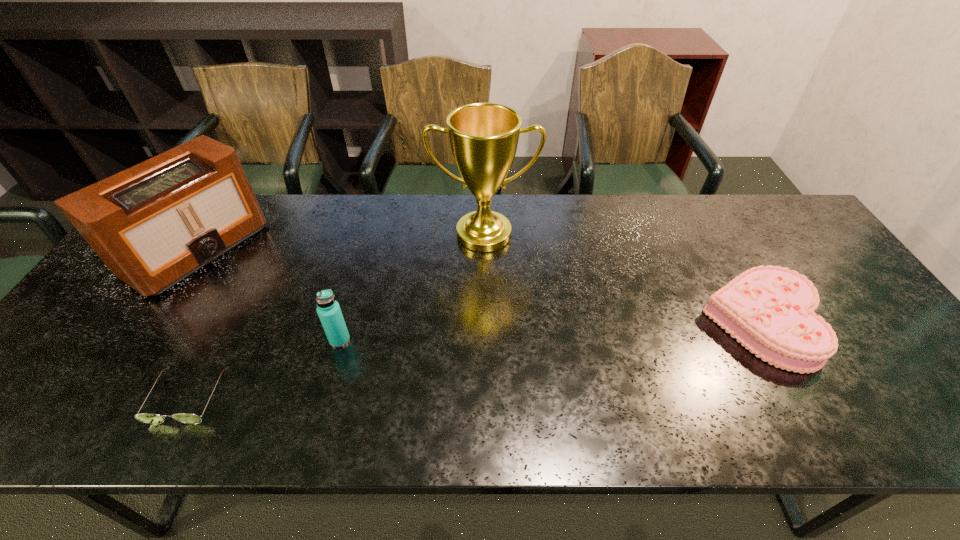
Image resolution: width=960 pixels, height=540 pixels. Find the location of `the second object from right to left`. the second object from right to left is located at coordinates (484, 137).

This screenshot has height=540, width=960. Find the location of `the tallest object`. the tallest object is located at coordinates (484, 137).

The height and width of the screenshot is (540, 960). Identify the location of radio receiver. (154, 224).

The image size is (960, 540). Find the location of `water bottle`. water bottle is located at coordinates (328, 309).

This screenshot has height=540, width=960. I want to click on the third tallest object, so click(x=328, y=309).

Locate an element on the screen. The height and width of the screenshot is (540, 960). cake is located at coordinates (769, 309).

The height and width of the screenshot is (540, 960). Identify the location of the rightmost object. (769, 309).

The height and width of the screenshot is (540, 960). Find the location of `sunglasses`. sunglasses is located at coordinates (x=149, y=418).

Where is `free space located by the handles of the second object from right to left`? Image resolution: width=960 pixels, height=540 pixels. free space located by the handles of the second object from right to left is located at coordinates (484, 272).

The width and height of the screenshot is (960, 540). Identify the location of free space located 0.310m on the front of the radio receiver. (91, 410).